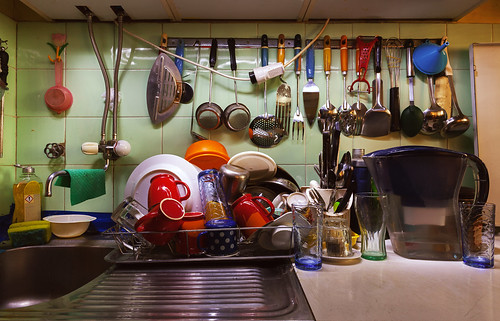
Identify the location of drinking glasses. The width and height of the screenshot is (500, 321). (370, 219), (308, 250), (212, 203), (126, 212), (337, 236), (480, 227).